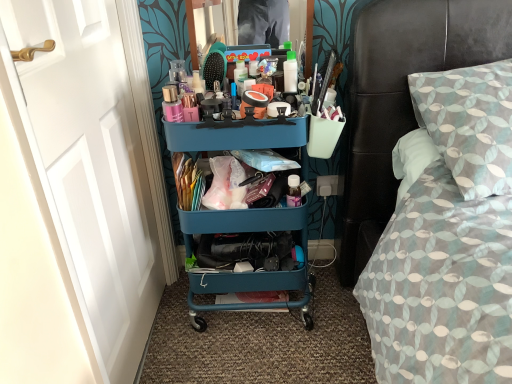
Find the location of a particular element. This screenshot has height=384, width=512. free location above teal plastic cart at center (from a real-world perspective) is located at coordinates (240, 111).